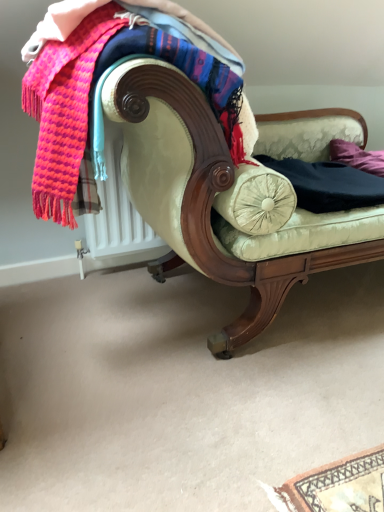
Question: Should I look upward or downward to see black cotton pants at center?

Choices:
 (A) down
 (B) up

Answer: (B)

Question: From a real-world perspective, does knitted wool scarf at upper left sit lower than velvet cream couch at center?

Choices:
 (A) yes
 (B) no

Answer: (B)

Question: From the image's perspective, is knitted wool scarf at upper left beneath velvet cream couch at center?

Choices:
 (A) no
 (B) yes

Answer: (A)

Question: Is knitted wool scarf at upper left positioned in front of velvet cream couch at center?

Choices:
 (A) yes
 (B) no

Answer: (B)

Question: Does knitted wool scarf at upper left appear on the right side of velvet cream couch at center?

Choices:
 (A) no
 (B) yes

Answer: (A)

Question: Does knitted wool scarf at upper left have a larger size compared to velvet cream couch at center?

Choices:
 (A) no
 (B) yes

Answer: (A)

Question: Considering the relative positions of knitted wool scarf at upper left and velvet cream couch at center in the image provided, is knitted wool scarf at upper left to the left of velvet cream couch at center from the viewer's perspective?

Choices:
 (A) no
 (B) yes

Answer: (B)

Question: Does velvet cream couch at center have a lesser width compared to knitted wool scarf at upper left?

Choices:
 (A) yes
 (B) no

Answer: (B)

Question: Is knitted wool scarf at upper left a part of velvet cream couch at center?

Choices:
 (A) no
 (B) yes

Answer: (B)

Question: Is velvet cream couch at center further to the viewer compared to knitted wool scarf at upper left?

Choices:
 (A) yes
 (B) no

Answer: (B)

Question: Is velvet cream couch at center not within knitted wool scarf at upper left?

Choices:
 (A) no
 (B) yes

Answer: (B)

Question: Is velvet cream couch at center positioned with its back to knitted wool scarf at upper left?

Choices:
 (A) yes
 (B) no

Answer: (B)

Question: From a real-world perspective, is velvet cream couch at center located beneath knitted wool scarf at upper left?

Choices:
 (A) yes
 (B) no

Answer: (A)

Question: Does knitted wool scarf at upper left have a smaller size compared to purple fabric pillow at right?

Choices:
 (A) no
 (B) yes

Answer: (A)